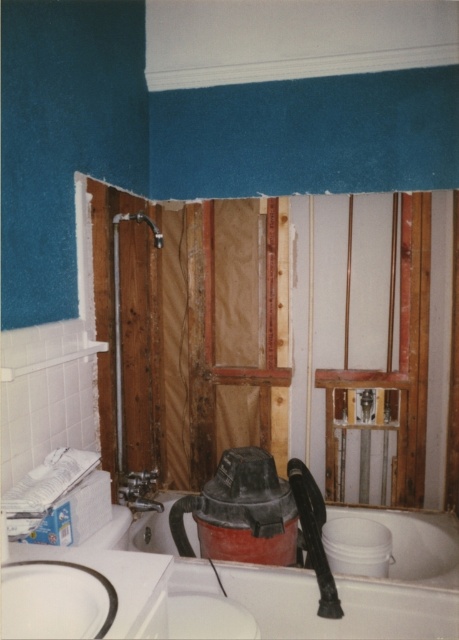
Question: Is white glossy bathtub at lower center positioned behind white glossy sink at lower left?

Choices:
 (A) no
 (B) yes

Answer: (B)

Question: Does white glossy bathtub at lower center appear on the left side of white glossy sink at lower left?

Choices:
 (A) no
 (B) yes

Answer: (A)

Question: Which object is farther from the camera taking this photo?

Choices:
 (A) white glossy sink at lower left
 (B) wooden panel at center
 (C) white glossy bathtub at lower center

Answer: (B)

Question: Can you confirm if white glossy bathtub at lower center is thinner than wooden panel at center?

Choices:
 (A) no
 (B) yes

Answer: (A)

Question: Estimate the real-world distances between objects in this image. Which object is farther from the white glossy sink at lower left?

Choices:
 (A) wooden panel at center
 (B) white glossy bathtub at lower center

Answer: (A)

Question: Among these points, which one is nearest to the camera?

Choices:
 (A) (375, 589)
 (B) (266, 355)

Answer: (A)